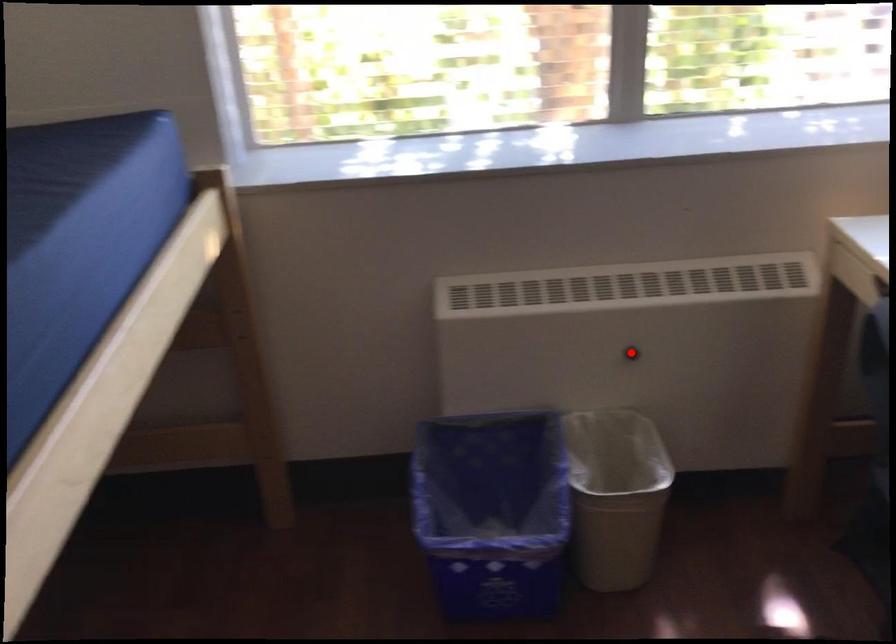
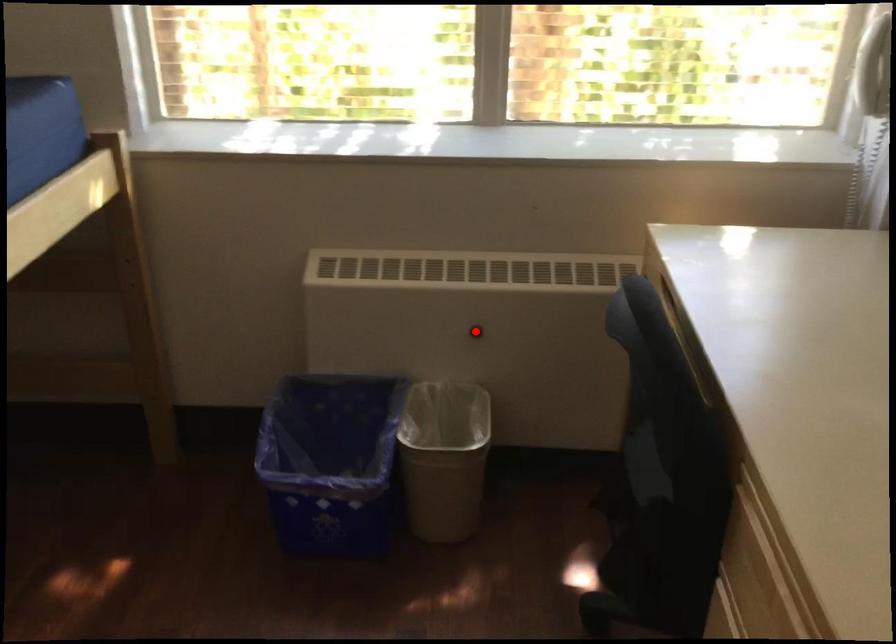
I am providing you with two images of the same scene from different viewpoints. A red point is marked on the first image and another point is marked on the second image. Do the highlighted points in image1 and image2 indicate the same real-world spot?

Yes